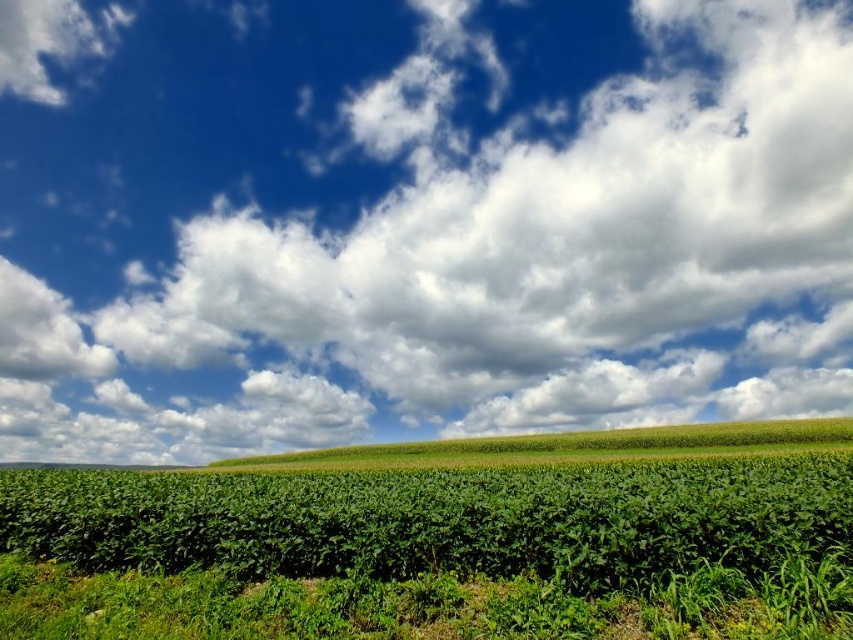
Question: Is white fluffy cloud at upper center bigger than green leafy corn at center?

Choices:
 (A) no
 (B) yes

Answer: (B)

Question: Can you confirm if white fluffy cloud at upper center is positioned to the right of green leafy corn at center?

Choices:
 (A) no
 (B) yes

Answer: (A)

Question: Can you confirm if white fluffy cloud at upper center is positioned above green leafy corn at center?

Choices:
 (A) yes
 (B) no

Answer: (A)